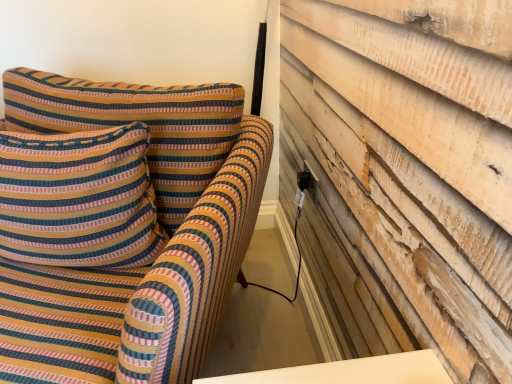
Question: Is black plastic electric outlet at upper right shorter than striped fabric pillow at upper left?

Choices:
 (A) no
 (B) yes

Answer: (B)

Question: From a real-world perspective, is black plastic electric outlet at upper right on top of striped fabric pillow at upper left?

Choices:
 (A) yes
 (B) no

Answer: (B)

Question: Is the position of black plastic electric outlet at upper right less distant than that of striped fabric pillow at upper left?

Choices:
 (A) yes
 (B) no

Answer: (B)

Question: Considering the relative sizes of black plastic electric outlet at upper right and striped fabric pillow at upper left in the image provided, is black plastic electric outlet at upper right thinner than striped fabric pillow at upper left?

Choices:
 (A) no
 (B) yes

Answer: (B)

Question: From the image's perspective, is black plastic electric outlet at upper right beneath striped fabric pillow at upper left?

Choices:
 (A) no
 (B) yes

Answer: (A)

Question: Considering the positions of black plastic electric outlet at upper right and striped fabric sofa at left in the image, is black plastic electric outlet at upper right wider or thinner than striped fabric sofa at left?

Choices:
 (A) thin
 (B) wide

Answer: (A)

Question: From a real-world perspective, is black plastic electric outlet at upper right above or below striped fabric sofa at left?

Choices:
 (A) above
 (B) below

Answer: (A)

Question: Is black plastic electric outlet at upper right inside the boundaries of striped fabric sofa at left, or outside?

Choices:
 (A) outside
 (B) inside

Answer: (A)

Question: Is black plastic electric outlet at upper right to the left or to the right of striped fabric sofa at left in the image?

Choices:
 (A) left
 (B) right

Answer: (B)

Question: Is striped fabric pillow at upper left situated inside black plastic electric outlet at upper right or outside?

Choices:
 (A) inside
 (B) outside

Answer: (B)

Question: Relative to black plastic electric outlet at upper right, is striped fabric pillow at upper left in front or behind?

Choices:
 (A) front
 (B) behind

Answer: (A)

Question: In terms of height, does striped fabric pillow at upper left look taller or shorter compared to black plastic electric outlet at upper right?

Choices:
 (A) tall
 (B) short

Answer: (A)

Question: Looking at the image, does striped fabric pillow at upper left seem bigger or smaller compared to black plastic electric outlet at upper right?

Choices:
 (A) big
 (B) small

Answer: (A)

Question: From the image's perspective, relative to striped fabric pillow at upper left, is striped fabric sofa at left above or below?

Choices:
 (A) above
 (B) below

Answer: (B)

Question: In terms of height, does striped fabric sofa at left look taller or shorter compared to striped fabric pillow at upper left?

Choices:
 (A) short
 (B) tall

Answer: (B)